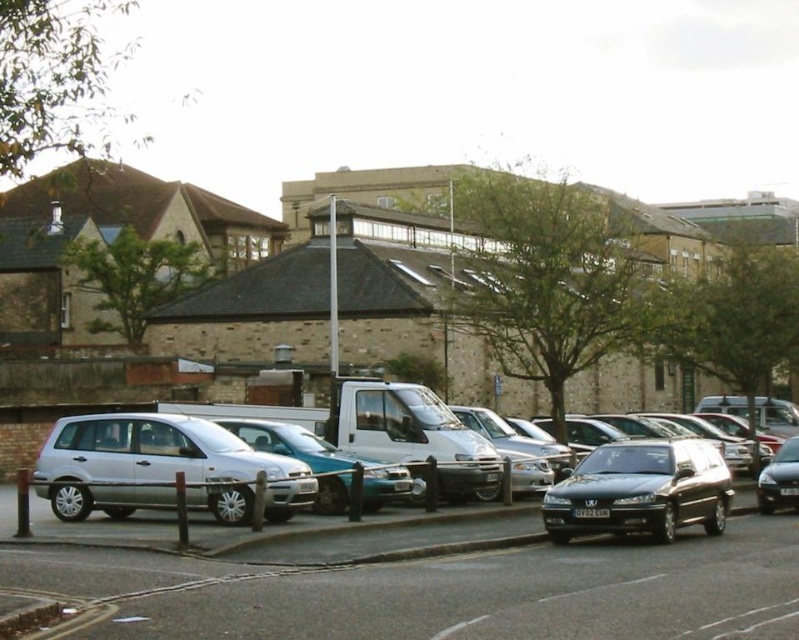
In the scene shown: You are a delivery person standing at the edge of the road, and you need to deliver a package to the shiny black car at center. The package must be placed exactly at the white plastic license plate at center. Can you reach the license plate without moving the car?

The shiny black car at center is 6.40 meters away from the white plastic license plate at center, which means the license plate is actually located on the car itself. Therefore, you can reach the white plastic license plate at center without moving the car.

You are a delivery person trying to park your vehicle between the silver metallic van at center and the shiny black sedan at right. According to the scene, can you fit your delivery truck which is 2 meters wide into the space between them?

The silver metallic van at center is positioned over the shiny black sedan at right, which means there is no space between them for the delivery truck to park. Therefore, the delivery truck cannot fit into the space between them.